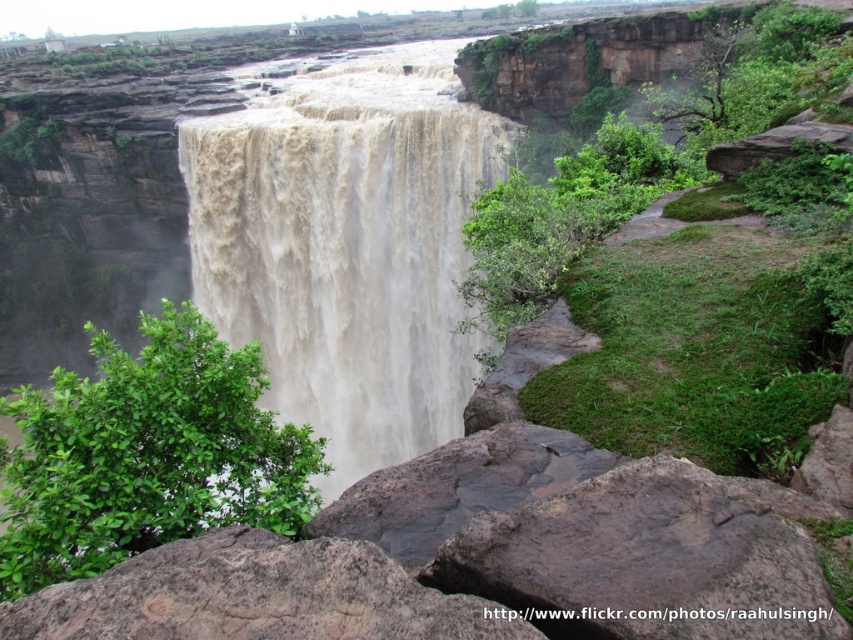
The image size is (853, 640). Find the location of `green leafy bush at lower left`. green leafy bush at lower left is located at coordinates (148, 454).

Does green leafy bush at lower left have a greater height compared to brown rough rock at center?

Correct, green leafy bush at lower left is much taller as brown rough rock at center.

Measure the distance between green leafy bush at lower left and camera.

green leafy bush at lower left and camera are 12.29 meters apart from each other.

What are the coordinates of `green leafy bush at lower left` in the screenshot? It's located at (148, 454).

Does white frothy water at center appear over brown rough rock at center?

Correct, white frothy water at center is located above brown rough rock at center.

Which is below, white frothy water at center or brown rough rock at center?

Positioned lower is brown rough rock at center.

Who is more forward, (422, 216) or (816, 580)?

Point (816, 580)

Locate an element on the screen. This screenshot has height=640, width=853. white frothy water at center is located at coordinates (347, 246).

Is the position of white frothy water at center less distant than that of green leafy bush at lower left?

That is False.

Who is more distant from viewer, (381, 125) or (165, 532)?

Point (381, 125)

Find the location of a particular element. The height and width of the screenshot is (640, 853). white frothy water at center is located at coordinates (347, 246).